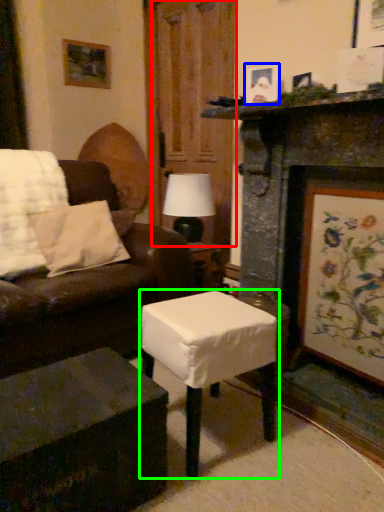
Question: Based on their relative distances, which object is nearer to glass door (highlighted by a red box)? Choose from picture frame (highlighted by a blue box) and table (highlighted by a green box).

Choices:
 (A) picture frame
 (B) table

Answer: (A)